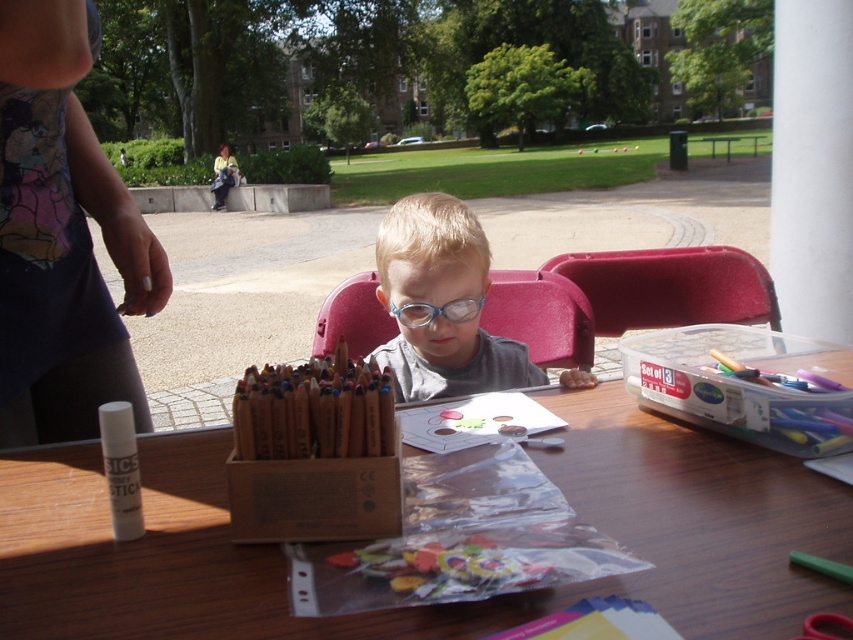
Question: Among these points, which one is farthest from the camera?

Choices:
 (A) (422, 310)
 (B) (132, 451)
 (C) (16, 557)
 (D) (463, 321)

Answer: (D)

Question: Does matte plastic child at center lie behind white matte glue stick at lower left?

Choices:
 (A) no
 (B) yes

Answer: (B)

Question: Which object appears farthest from the camera in this image?

Choices:
 (A) wooden at center
 (B) blue plastic glasses at center

Answer: (B)

Question: Can you confirm if matte plastic child at center is positioned below white matte glue stick at lower left?

Choices:
 (A) no
 (B) yes

Answer: (A)

Question: Does matte plastic child at center appear over white matte glue stick at lower left?

Choices:
 (A) yes
 (B) no

Answer: (A)

Question: Which is farther from the matte plastic child at center?

Choices:
 (A) blue plastic glasses at center
 (B) white matte glue stick at lower left

Answer: (B)